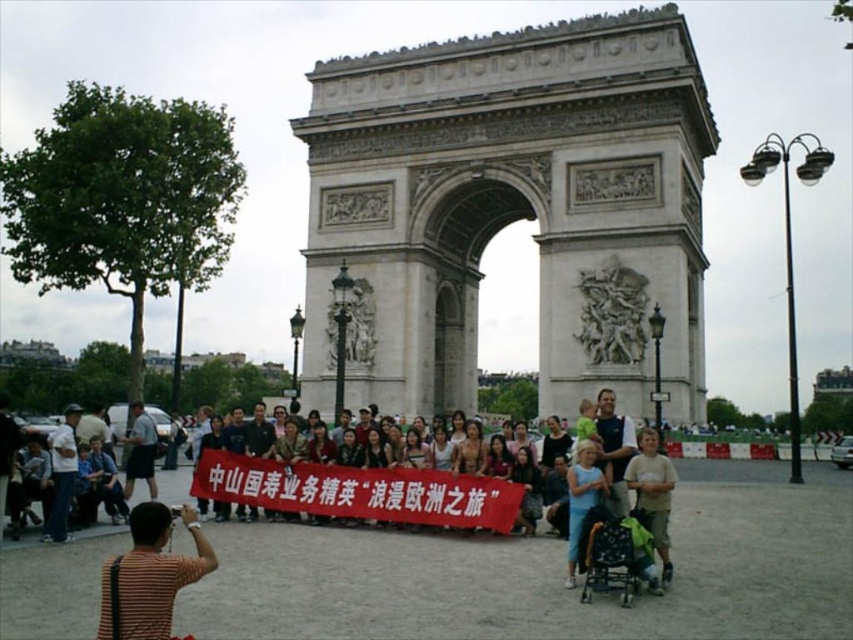
You are a photographer positioned at the entrance of the Arc de Triomphe. You need to capture a photo of the matte brown banner at center without including any people in the frame. Based on its position, can you determine if this is possible?

The matte brown banner at center is located at point (x=360, y=492), which likely places it in the foreground where the group is standing. Since the group is posing behind the banner, capturing the banner without people may be challenging as they are positioned closely around it.

You are a photographer standing at the center of the Arc de Triomphe. You want to place a new banner at the same position as the matte brown banner at center. What are the coordinates where you should place the new banner?

The coordinates for the matte brown banner at center are at point [360,492].